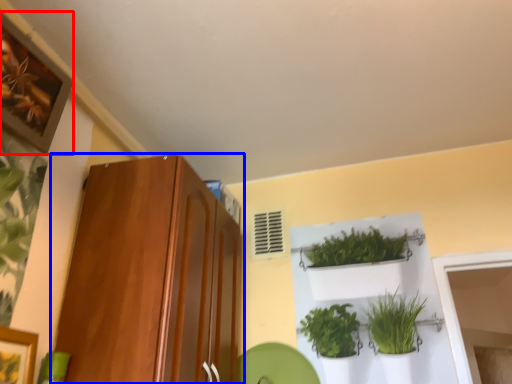
Question: Which object appears farthest to the camera in this image, picture frame (highlighted by a red box) or cabinetry (highlighted by a blue box)?

Choices:
 (A) picture frame
 (B) cabinetry

Answer: (B)